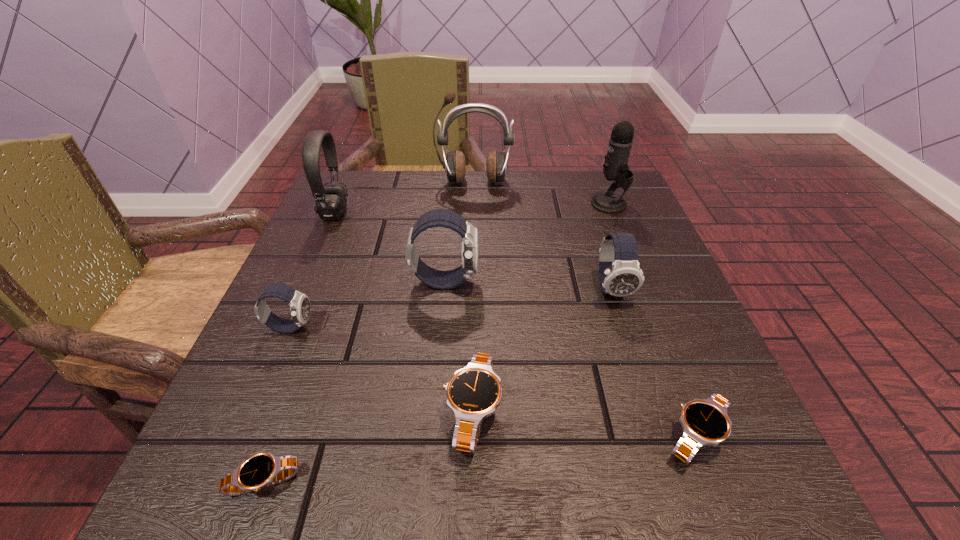
This screenshot has height=540, width=960. I want to click on free spot located 0.230m on the face of the second biggest dark watch, so click(x=657, y=430).

The height and width of the screenshot is (540, 960). In order to click on free space located 0.060m on the face of the third farthest watch in this screenshot , I will do tap(348, 327).

At what (x,y) coordinates should I click in order to perform the action: click on vacant space situated on the left of the second black watch from right to left. Please return your answer as a coordinate pair (x, y). The height and width of the screenshot is (540, 960). Looking at the image, I should click on (297, 411).

Image resolution: width=960 pixels, height=540 pixels. Find the location of `free region located on the back of the fifth tallest watch`. free region located on the back of the fifth tallest watch is located at coordinates (664, 355).

At what (x,y) coordinates should I click in order to perform the action: click on vacant space located on the back of the shortest watch. Please return your answer as a coordinate pair (x, y). The width and height of the screenshot is (960, 540). Looking at the image, I should click on (332, 293).

Identify the location of earphone at the far edge. (455, 165).

Locate an element on the screen. This screenshot has width=960, height=540. microphone that is at the far edge is located at coordinates (615, 168).

Identify the location of headset located at the far edge. (330, 200).

You are a GUI agent. You are given a task and a screenshot of the screen. Output one action in this format:
    pyautogui.click(x=<x>, y=<y>)
    Task: Click on the headset at the left edge
    Image resolution: width=960 pixels, height=540 pixels.
    Given the screenshot: What is the action you would take?
    pyautogui.click(x=330, y=200)

At what (x,y) coordinates should I click in order to perform the action: click on microphone that is at the right edge. Please return your answer as a coordinate pair (x, y). Looking at the image, I should click on (615, 168).